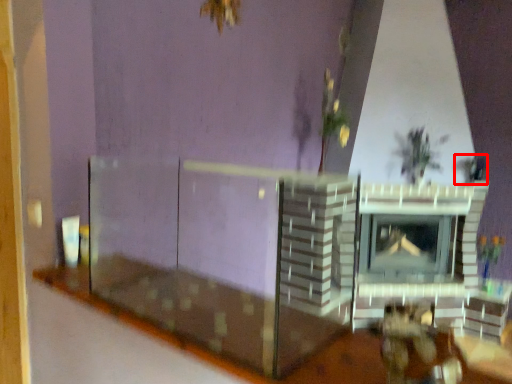
Question: From the image's perspective, considering the relative positions of plant (annotated by the red box) and table in the image provided, where is plant (annotated by the red box) located with respect to the staircase?

Choices:
 (A) below
 (B) above

Answer: (B)